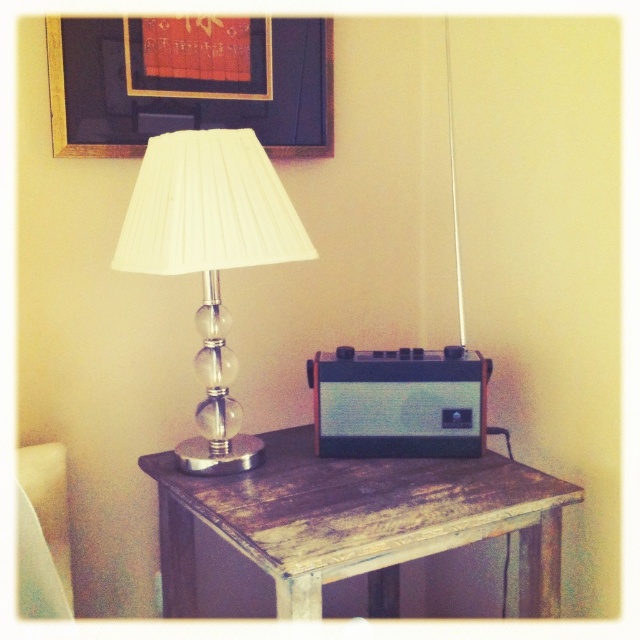
This screenshot has height=640, width=640. In order to click on distressed wood table at center in this screenshot , I will do `click(356, 522)`.

Can you confirm if distressed wood table at center is bigger than matte gold picture frame at upper center?

Correct, distressed wood table at center is larger in size than matte gold picture frame at upper center.

Which is behind, point (374, 532) or point (180, 83)?

Point (180, 83)

At what (x,y) coordinates should I click in order to perform the action: click on distressed wood table at center. Please return your answer as a coordinate pair (x, y). Looking at the image, I should click on (356, 522).

Is matte gold picture frame at upper center taller than white pleated fabric lampshade at left?

Incorrect, matte gold picture frame at upper center's height is not larger of white pleated fabric lampshade at left's.

Is matte gold picture frame at upper center below white pleated fabric lampshade at left?

No.

What do you see at coordinates (189, 81) in the screenshot? The width and height of the screenshot is (640, 640). I see `matte gold picture frame at upper center` at bounding box center [189, 81].

I want to click on matte gold picture frame at upper center, so click(189, 81).

Describe the element at coordinates (356, 522) in the screenshot. The image size is (640, 640). I see `distressed wood table at center` at that location.

In the scene shown: Which is more to the left, distressed wood table at center or white pleated fabric lampshade at left?

Positioned to the left is white pleated fabric lampshade at left.

Who is more forward, (308, 467) or (131, 208)?

Point (131, 208)

What are the coordinates of `distressed wood table at center` in the screenshot? It's located at (356, 522).